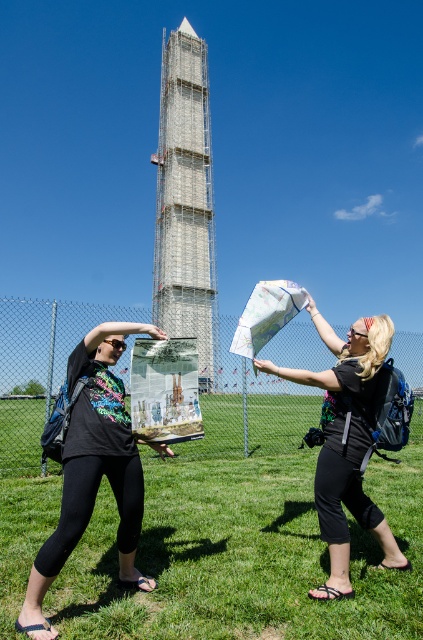
You are standing at the center of the image. Which direction should you look to see the scaffolding metal tower at center?

The scaffolding metal tower at center is located at the center of the image, so you should look straight ahead to see it.

You are a tour guide leading a group to the scaffolding metal tower at center. You see the black fabric pants at lower center. Is the person wearing them closer to the tower or farther away from it compared to you?

The black fabric pants at lower center is closer to the viewer than scaffolding metal tower at center, so the person is closer to the tower than you are.